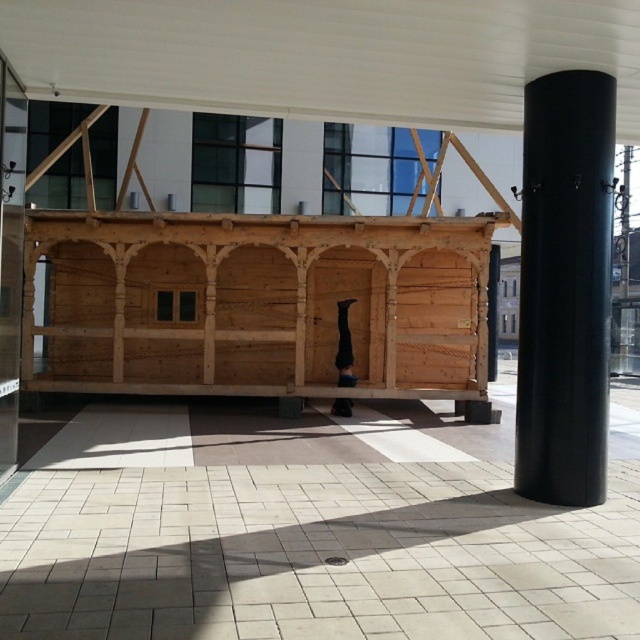
Which is more to the right, white matte canopy at upper center or black matte cylinder at right?

black matte cylinder at right is more to the right.

Consider the image. Does white matte canopy at upper center appear over black matte cylinder at right?

Yes, white matte canopy at upper center is above black matte cylinder at right.

Which is behind, point (58, 10) or point (564, 84)?

The point (564, 84) is behind.

Locate an element on the screen. white matte canopy at upper center is located at coordinates (324, 54).

Which of these two, natural wood log cabin at center or black matte cylinder at right, stands taller?

black matte cylinder at right is taller.

Between point (99, 259) and point (518, 390), which one is positioned behind?

Point (99, 259)

You are a GUI agent. You are given a task and a screenshot of the screen. Output one action in this format:
    pyautogui.click(x=<x>, y=<y>)
    Task: Click on the natural wood log cabin at center
    Image resolution: width=640 pixels, height=640 pixels.
    Given the screenshot: What is the action you would take?
    pyautogui.click(x=259, y=305)

This screenshot has height=640, width=640. What are the coordinates of `natural wood log cabin at center` in the screenshot? It's located at (259, 305).

Can you confirm if natural wood log cabin at center is positioned to the right of white matte canopy at upper center?

Incorrect, natural wood log cabin at center is not on the right side of white matte canopy at upper center.

Locate an element on the screen. The height and width of the screenshot is (640, 640). natural wood log cabin at center is located at coordinates (259, 305).

Which is in front, point (125, 323) or point (316, 102)?

Point (316, 102) is in front.

Identify the location of natural wood log cabin at center. The width and height of the screenshot is (640, 640). (259, 305).